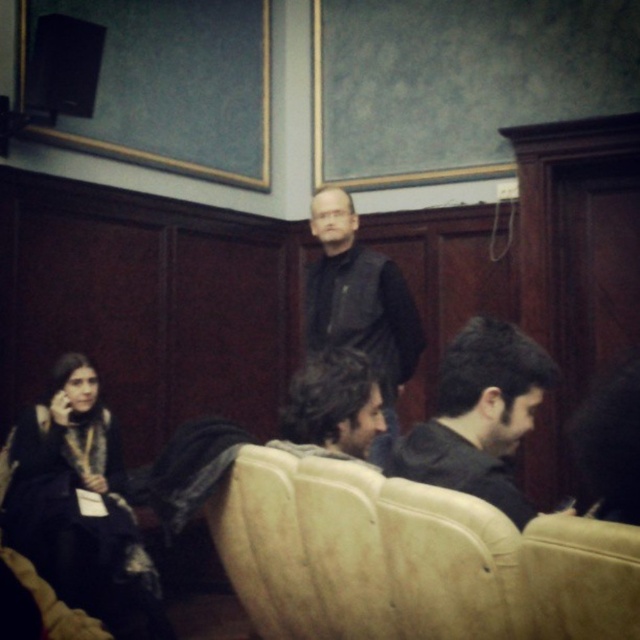
Does dark matte dress at lower left appear on the right side of dark gray hoodie at center?

In fact, dark matte dress at lower left is to the left of dark gray hoodie at center.

Can you confirm if dark matte dress at lower left is positioned to the left of dark gray hoodie at center?

Correct, you'll find dark matte dress at lower left to the left of dark gray hoodie at center.

The image size is (640, 640). What do you see at coordinates (80, 506) in the screenshot? I see `dark matte dress at lower left` at bounding box center [80, 506].

What are the coordinates of `dark matte dress at lower left` in the screenshot? It's located at (80, 506).

Which of these two, dark matte dress at lower left or dark brown hair at center, stands taller?

dark matte dress at lower left

Can you confirm if dark matte dress at lower left is smaller than dark brown hair at center?

Actually, dark matte dress at lower left might be larger than dark brown hair at center.

Does point (106, 499) come closer to viewer compared to point (316, 355)?

That is False.

This screenshot has width=640, height=640. In order to click on dark matte dress at lower left in this screenshot , I will do `click(80, 506)`.

Which is behind, point (452, 422) or point (316, 355)?

Positioned behind is point (316, 355).

Does point (496, 344) lie in front of point (369, 369)?

Yes, point (496, 344) is in front of point (369, 369).

Find the location of `dark gray hoodie at center`. dark gray hoodie at center is located at coordinates (477, 416).